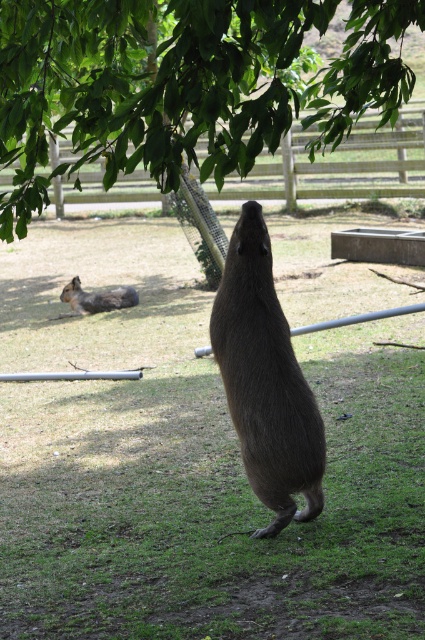
You are a zookeeper observing the capybaras in their enclosure. You notice a specific point marked at coordinates (x=266, y=380). Which capybara does this point correspond to?

The point at coordinates (x=266, y=380) corresponds to the brown furry capybara at center.

You are a zookeeper observing the capybaras in their enclosure. You notice the brown furry capybara at center and the wooden fence at upper center. Which object is closer to the left edge of the enclosure?

The brown furry capybara at center is positioned on the left side of the wooden fence at upper center, so it is closer to the left edge of the enclosure.

You are a zookeeper who needs to feed two capybaras. The brown furry capybara at center is standing upright, and the brown furry rodent at lower left is lying down. If you are standing at the entrance of the enclosure, which capybara is closer to you?

The brown furry rodent at lower left is closer to you because it is only 5.85 meters away from the brown furry capybara at center, and since you are at the entrance, the one closer to the entrance would depend on their positions. However, based on the given distance between them, if the rodent is at lower left and the capybara at center, the rodent might be nearer if the entrance is near the lower left area. But without exact entrance position, we can only state their mutual distance. Wait, the question is,